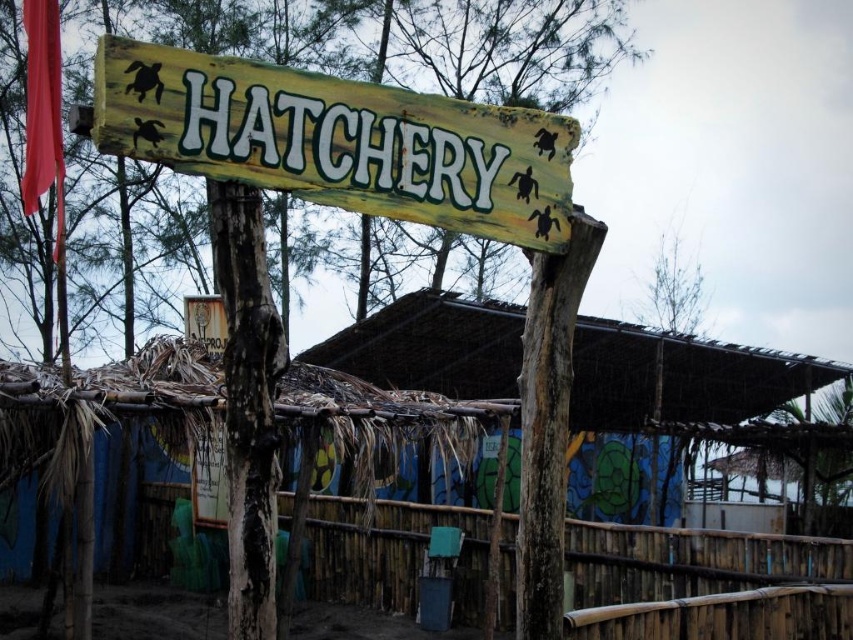
You are a visitor at the turtle hatchery and want to take a photo of the wooden signboard at center and the bamboo fence at lower center. To ensure both are fully visible in the frame, where should you position yourself relative to the hatchery structure?

You should position yourself in front of the hatchery structure so that the wooden signboard at center is above and the bamboo fence at lower center is below, ensuring both are fully visible in the frame.